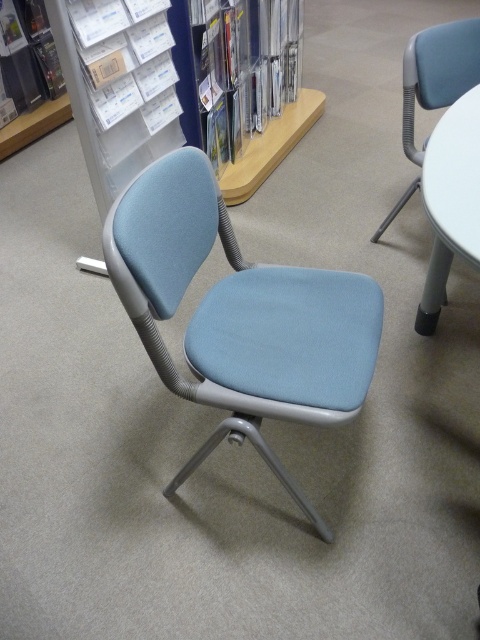
Can you confirm if light blue fabric swivel chair at center is taller than white plastic table at right?

Yes.

What do you see at coordinates (239, 316) in the screenshot? I see `light blue fabric swivel chair at center` at bounding box center [239, 316].

Locate an element on the screen. light blue fabric swivel chair at center is located at coordinates (239, 316).

You are a GUI agent. You are given a task and a screenshot of the screen. Output one action in this format:
    pyautogui.click(x=<x>, y=<y>)
    Task: Click on the light blue fabric swivel chair at center
    
    Given the screenshot: What is the action you would take?
    pyautogui.click(x=239, y=316)

Is point (458, 173) closer to camera compared to point (458, 40)?

Yes.

Based on the photo, who is positioned more to the right, white plastic table at right or light blue fabric chair at center?

Positioned to the right is light blue fabric chair at center.

Is point (452, 148) positioned after point (446, 100)?

That is False.

Locate an element on the screen. This screenshot has width=480, height=640. white plastic table at right is located at coordinates (451, 198).

Who is more forward, (178,481) or (466,36)?

Positioned in front is point (178,481).

Is light blue fabric swivel chair at center bigger than light blue fabric chair at center?

Indeed, light blue fabric swivel chair at center has a larger size compared to light blue fabric chair at center.

At what (x,y) coordinates should I click in order to perform the action: click on light blue fabric swivel chair at center. Please return your answer as a coordinate pair (x, y). Image resolution: width=480 pixels, height=640 pixels. Looking at the image, I should click on (239, 316).